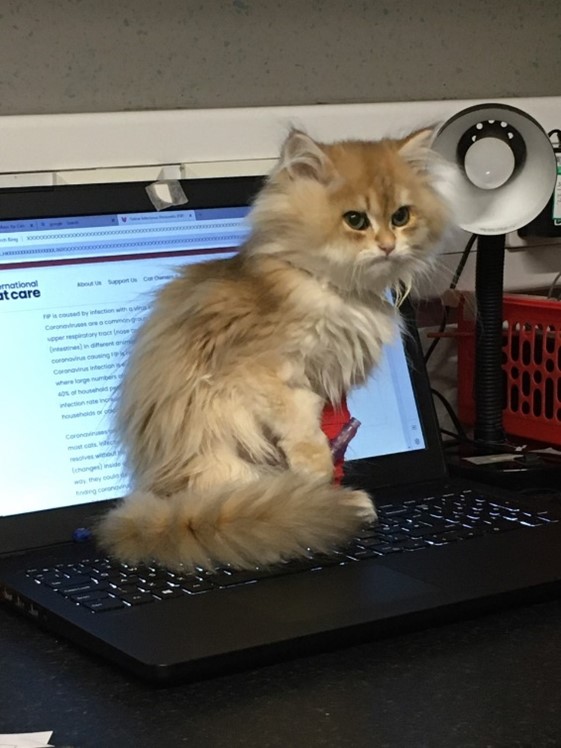
This screenshot has width=561, height=748. I want to click on black wire, so click(461, 268), click(453, 419), click(453, 432).